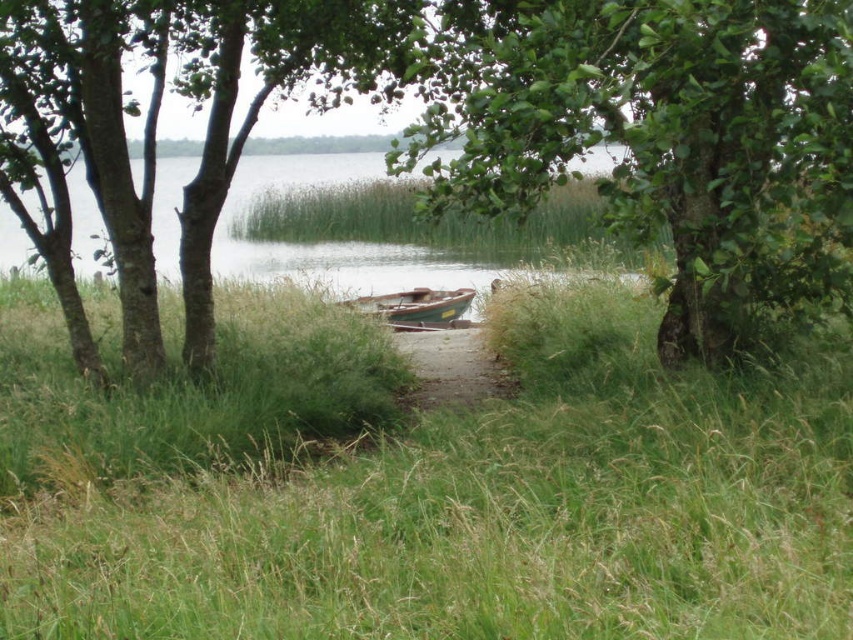
You are a hiker trying to find the best spot to set up a tent. You notice the green grassy at center and the brown dirt path at center. Which location would be more suitable for setting up your tent, and why?

The green grassy at center is more suitable for setting up the tent because it is located below the brown dirt path at center, making it less exposed to potential runoff water during rain.

You are standing at the edge of the lake and want to return to the parking lot located at the coordinates mentioned in the scene. Which direction should you walk relative to the brown dirt path at center?

The brown dirt path at center is located at point [451,365]. Since the path leads directly to the edge of the lake, you should walk in the opposite direction of the path to reach the parking lot.

You are standing at the point marked by the coordinates point (451,365). Which direction should you walk to reach the lake?

The point (451,365) corresponds to the brown dirt path at center, which leads directly to the edge of the lake. Therefore, walking forward along the path will take you to the lake.